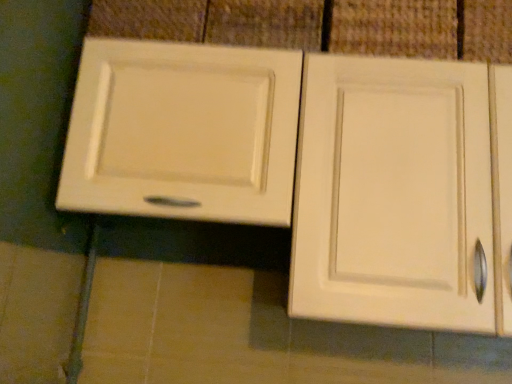
Question: From the image's perspective, would you say white matte cabinet door at upper center is shown under matte white cabinet at upper left?

Choices:
 (A) yes
 (B) no

Answer: (B)

Question: Is white matte cabinet door at upper center oriented towards matte white cabinet at upper left?

Choices:
 (A) yes
 (B) no

Answer: (A)

Question: Considering the relative sizes of white matte cabinet door at upper center and matte white cabinet at upper left in the image provided, is white matte cabinet door at upper center smaller than matte white cabinet at upper left?

Choices:
 (A) no
 (B) yes

Answer: (B)

Question: Is white matte cabinet door at upper center not inside matte white cabinet at upper left?

Choices:
 (A) no
 (B) yes

Answer: (A)

Question: Is white matte cabinet door at upper center next to matte white cabinet at upper left?

Choices:
 (A) no
 (B) yes

Answer: (A)

Question: Is white matte cabinet door at upper center oriented away from matte white cabinet at upper left?

Choices:
 (A) yes
 (B) no

Answer: (A)

Question: Is matte white cabinet at upper left facing away from white matte cabinet door at upper center?

Choices:
 (A) no
 (B) yes

Answer: (A)

Question: Does matte white cabinet at upper left have a lesser height compared to white matte cabinet door at upper center?

Choices:
 (A) no
 (B) yes

Answer: (A)

Question: Is matte white cabinet at upper left outside of white matte cabinet door at upper center?

Choices:
 (A) yes
 (B) no

Answer: (A)

Question: From the image's perspective, does matte white cabinet at upper left appear lower than white matte cabinet door at upper center?

Choices:
 (A) no
 (B) yes

Answer: (B)

Question: Is matte white cabinet at upper left in front of white matte cabinet door at upper center?

Choices:
 (A) yes
 (B) no

Answer: (A)

Question: Does matte white cabinet at upper left have a greater width compared to white matte cabinet door at upper center?

Choices:
 (A) yes
 (B) no

Answer: (A)

Question: Is point (132, 72) positioned closer to the camera than point (419, 4)?

Choices:
 (A) closer
 (B) farther

Answer: (A)